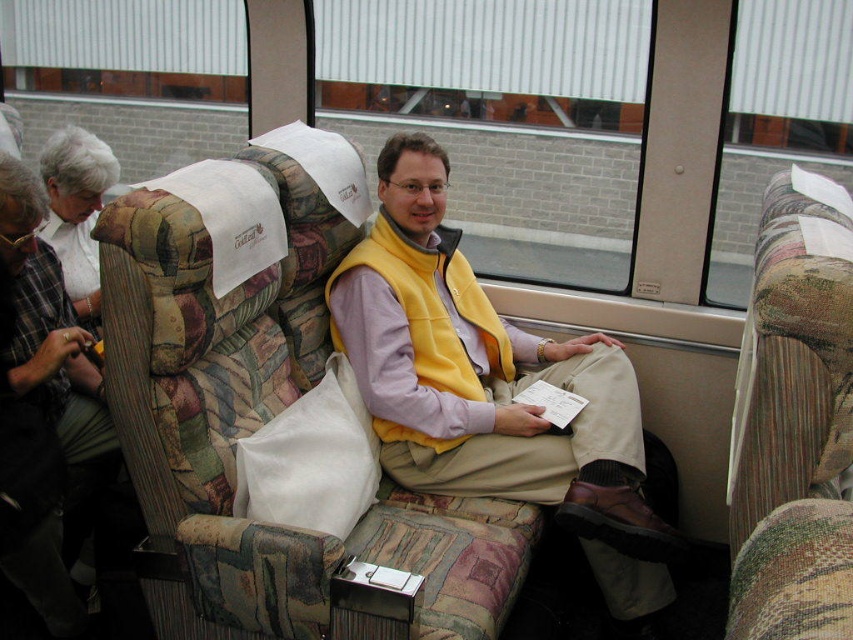
You are designing a seating arrangement for a small waiting area and need to place both the patterned fabric armchair at center and the yellow fleece vest at center. Given their sizes, which object should you prioritize placing first to ensure they both fit comfortably?

The patterned fabric armchair at center is narrower than the yellow fleece vest at center, so you should prioritize placing the yellow fleece vest at center first to accommodate its larger size and ensure both fit comfortably.

You are standing in the bus or train interior described. There is a point labeled at coordinates (265,406). What object is located at this point?

The point at coordinates (265,406) corresponds to the patterned fabric armchair at center.